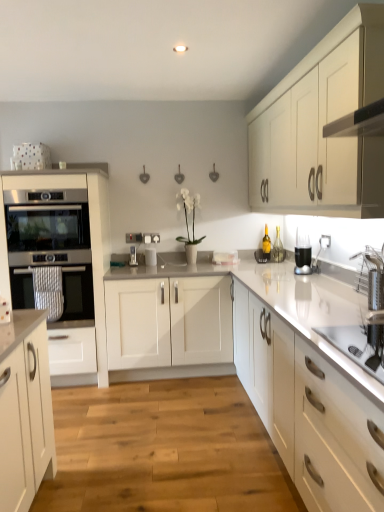
Question: Is white matte cabinet at upper right, which is the first cabinetry from right to left, positioned with its back to satin white oven at left, placed as the first cabinetry when sorted from left to right?

Choices:
 (A) no
 (B) yes

Answer: (A)

Question: From a real-world perspective, is white matte cabinet at upper right, which is the first cabinetry from right to left, located higher than satin white oven at left, placed as the first cabinetry when sorted from left to right?

Choices:
 (A) yes
 (B) no

Answer: (A)

Question: Does white matte cabinet at upper right, which is the first cabinetry from right to left, have a greater height compared to satin white oven at left, the second cabinetry positioned from the right?

Choices:
 (A) yes
 (B) no

Answer: (B)

Question: Is white matte cabinet at upper right, which is the first cabinetry from right to left, wider than satin white oven at left, placed as the first cabinetry when sorted from left to right?

Choices:
 (A) yes
 (B) no

Answer: (B)

Question: Is white matte cabinet at upper right, the 2th cabinetry positioned from the left, at the left side of satin white oven at left, placed as the first cabinetry when sorted from left to right?

Choices:
 (A) no
 (B) yes

Answer: (A)

Question: Considering their positions, is wooden floor at center located in front of or behind white matte cabinet at upper right, which is the first cabinetry from right to left?

Choices:
 (A) front
 (B) behind

Answer: (B)

Question: From their relative heights in the image, would you say wooden floor at center is taller or shorter than white matte cabinet at upper right, the 2th cabinetry positioned from the left?

Choices:
 (A) tall
 (B) short

Answer: (B)

Question: Based on their sizes in the image, would you say wooden floor at center is bigger or smaller than white matte cabinet at upper right, the 2th cabinetry positioned from the left?

Choices:
 (A) small
 (B) big

Answer: (A)

Question: Do you think wooden floor at center is within white matte cabinet at upper right, which is the first cabinetry from right to left, or outside of it?

Choices:
 (A) outside
 (B) inside

Answer: (A)

Question: From a real-world perspective, is metallic silver toaster at center, the 2th appliance positioned from the right, above or below black plastic blender at upper right?

Choices:
 (A) above
 (B) below

Answer: (B)

Question: Looking at their shapes, would you say metallic silver toaster at center, placed as the 1th appliance when sorted from left to right, is wider or thinner than black plastic blender at upper right?

Choices:
 (A) thin
 (B) wide

Answer: (A)

Question: Does point (132, 259) appear closer or farther from the camera than point (304, 245)?

Choices:
 (A) farther
 (B) closer

Answer: (A)

Question: Considering their positions, is metallic silver toaster at center, the 2th appliance positioned from the right, located in front of or behind black plastic blender at upper right?

Choices:
 (A) front
 (B) behind

Answer: (B)

Question: Is black plastic blender at upper right in front of or behind metallic silver toaster at center, the 2th appliance positioned from the right, in the image?

Choices:
 (A) behind
 (B) front

Answer: (B)

Question: Is black plastic blender at upper right bigger or smaller than metallic silver toaster at center, placed as the 1th appliance when sorted from left to right?

Choices:
 (A) big
 (B) small

Answer: (A)